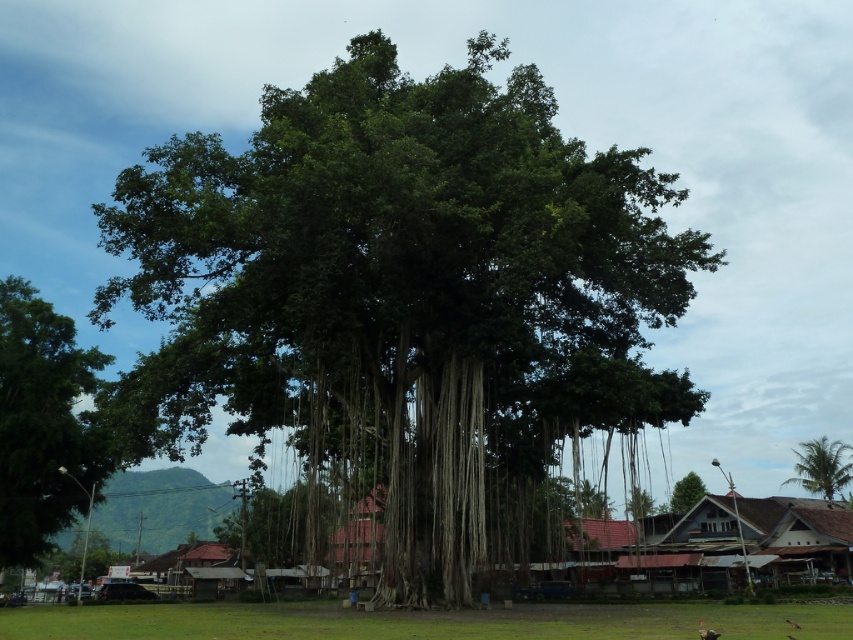
Question: Is green leafy tree at left thinner than green leafy tree at center?

Choices:
 (A) no
 (B) yes

Answer: (B)

Question: Based on their relative distances, which object is farther from the green leafy tree at upper right?

Choices:
 (A) green grass at lower center
 (B) green leafy tree at center
 (C) brown corrugated metal hut at lower right

Answer: (A)

Question: Which point is farther to the camera?

Choices:
 (A) (693, 499)
 (B) (816, 467)

Answer: (A)

Question: Which is farther from the green grass at lower center?

Choices:
 (A) green leafy banyan tree at center
 (B) green leafy tree at center
 (C) green leafy tree at left
 (D) brown corrugated metal hut at lower right

Answer: (B)

Question: Does green grass at lower center have a lesser width compared to green leafy tree at left?

Choices:
 (A) yes
 (B) no

Answer: (B)

Question: Is green leafy tree at left wider than green leafy tree at upper right?

Choices:
 (A) yes
 (B) no

Answer: (B)